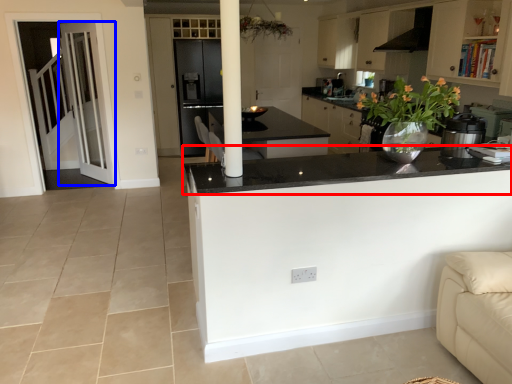
Question: Among these objects, which one is nearest to the camera, countertop (highlighted by a red box) or door (highlighted by a blue box)?

Choices:
 (A) countertop
 (B) door

Answer: (A)